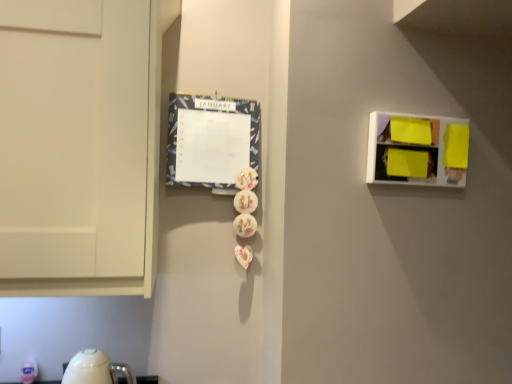
This screenshot has width=512, height=384. What do you see at coordinates (417, 150) in the screenshot?
I see `bright yellow plastic at upper right` at bounding box center [417, 150].

The height and width of the screenshot is (384, 512). Find the location of `bright yellow plastic at upper right`. bright yellow plastic at upper right is located at coordinates pyautogui.click(x=417, y=150).

The image size is (512, 384). What do you see at coordinates (211, 140) in the screenshot? I see `blue fabric calendar at center-left` at bounding box center [211, 140].

Where is `blue fabric calendar at center-left`? The image size is (512, 384). blue fabric calendar at center-left is located at coordinates (211, 140).

This screenshot has height=384, width=512. I want to click on bright yellow plastic at upper right, so click(x=417, y=150).

Between bright yellow plastic at upper right and blue fabric calendar at center-left, which one appears on the left side from the viewer's perspective?

blue fabric calendar at center-left is more to the left.

Is bright yellow plastic at upper right positioned in front of blue fabric calendar at center-left?

Yes, the depth of bright yellow plastic at upper right is less than that of blue fabric calendar at center-left.

Looking at this image, which is nearer, (376, 174) or (184, 116)?

Point (376, 174) appears to be closer to the viewer than point (184, 116).

From the image's perspective, does bright yellow plastic at upper right appear higher than blue fabric calendar at center-left?

No, from the image's perspective, bright yellow plastic at upper right is not on top of blue fabric calendar at center-left.

From a real-world perspective, which is physically above, bright yellow plastic at upper right or blue fabric calendar at center-left?

blue fabric calendar at center-left.

Looking at their sizes, would you say bright yellow plastic at upper right is wider or thinner than blue fabric calendar at center-left?

In the image, bright yellow plastic at upper right appears to be wider than blue fabric calendar at center-left.

Is bright yellow plastic at upper right shorter than blue fabric calendar at center-left?

Indeed, bright yellow plastic at upper right has a lesser height compared to blue fabric calendar at center-left.

Is bright yellow plastic at upper right smaller than blue fabric calendar at center-left?

Yes, bright yellow plastic at upper right is smaller than blue fabric calendar at center-left.

Which is correct: bright yellow plastic at upper right is inside blue fabric calendar at center-left, or outside of it?

The correct answer is: outside.

Does bright yellow plastic at upper right touch blue fabric calendar at center-left?

There is a gap between bright yellow plastic at upper right and blue fabric calendar at center-left.

Is bright yellow plastic at upper right aimed at blue fabric calendar at center-left?

No, bright yellow plastic at upper right is not turned towards blue fabric calendar at center-left.

The height and width of the screenshot is (384, 512). I want to click on bulletin board that is above the bright yellow plastic at upper right (from a real-world perspective), so (211, 140).

Between blue fabric calendar at center-left and bright yellow plastic at upper right, which one appears on the left side from the viewer's perspective?

Positioned to the left is blue fabric calendar at center-left.

Is the position of blue fabric calendar at center-left less distant than that of bright yellow plastic at upper right?

That is False.

Which is in front, point (257, 147) or point (383, 152)?

The point (383, 152) is closer.

From the image's perspective, is blue fabric calendar at center-left located above or below bright yellow plastic at upper right?

Clearly, from the image's perspective, blue fabric calendar at center-left is above bright yellow plastic at upper right.

From a real-world perspective, is blue fabric calendar at center-left located higher than bright yellow plastic at upper right?

Indeed, from a real-world perspective, blue fabric calendar at center-left stands above bright yellow plastic at upper right.

Considering the sizes of objects blue fabric calendar at center-left and bright yellow plastic at upper right in the image provided, who is thinner, blue fabric calendar at center-left or bright yellow plastic at upper right?

Thinner between the two is blue fabric calendar at center-left.

In the scene shown: Can you confirm if blue fabric calendar at center-left is shorter than bright yellow plastic at upper right?

Incorrect, the height of blue fabric calendar at center-left does not fall short of that of bright yellow plastic at upper right.

Does blue fabric calendar at center-left have a smaller size compared to bright yellow plastic at upper right?

Incorrect, blue fabric calendar at center-left is not smaller in size than bright yellow plastic at upper right.

Does blue fabric calendar at center-left contain bright yellow plastic at upper right?

No, bright yellow plastic at upper right is not inside blue fabric calendar at center-left.

Is blue fabric calendar at center-left far from bright yellow plastic at upper right?

blue fabric calendar at center-left is near bright yellow plastic at upper right, not far away.

Is blue fabric calendar at center-left looking in the opposite direction of bright yellow plastic at upper right?

No.

How different are the orientations of blue fabric calendar at center-left and bright yellow plastic at upper right in degrees?

0.0123 degrees.

This screenshot has height=384, width=512. I want to click on shelf that is below the blue fabric calendar at center-left (from the image's perspective), so click(417, 150).

At what (x,y) coordinates should I click in order to perform the action: click on bulletin board that appears behind the bright yellow plastic at upper right. Please return your answer as a coordinate pair (x, y). Looking at the image, I should click on (211, 140).

Locate an element on the screen. bulletin board above the bright yellow plastic at upper right (from the image's perspective) is located at coordinates (211, 140).